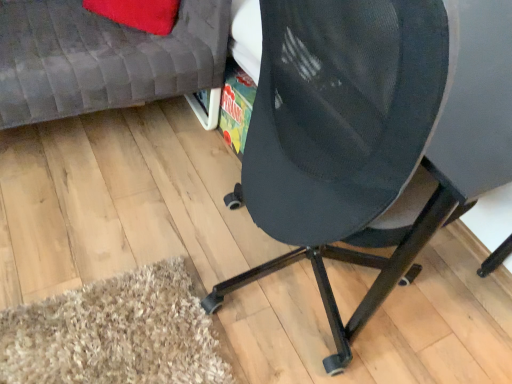
The height and width of the screenshot is (384, 512). Identify the location of matte gray couch at upper left. (102, 59).

What is the approximate width of matte gray couch at upper left?

matte gray couch at upper left is 30.33 inches in width.

What do you see at coordinates (102, 59) in the screenshot? I see `matte gray couch at upper left` at bounding box center [102, 59].

Where is `black mesh chair at center`? Image resolution: width=512 pixels, height=384 pixels. black mesh chair at center is located at coordinates (372, 130).

What is the approximate width of black mesh chair at center?

28.31 inches.

This screenshot has width=512, height=384. Describe the element at coordinates (372, 130) in the screenshot. I see `black mesh chair at center` at that location.

Measure the distance between point (323, 84) and camera.

Point (323, 84) and camera are 28.19 inches apart.

Locate an element on the screen. matte gray couch at upper left is located at coordinates (102, 59).

Does black mesh chair at center appear on the right side of matte gray couch at upper left?

Correct, you'll find black mesh chair at center to the right of matte gray couch at upper left.

From the picture: Is the position of black mesh chair at center less distant than that of matte gray couch at upper left?

Yes, black mesh chair at center is in front of matte gray couch at upper left.

Does point (383, 136) appear closer or farther from the camera than point (35, 20)?

Clearly, point (383, 136) is closer to the camera than point (35, 20).

From the image's perspective, relative to matte gray couch at upper left, is black mesh chair at center above or below?

Based on their image positions, black mesh chair at center is located beneath matte gray couch at upper left.

From a real-world perspective, which object stands above the other?

black mesh chair at center, from a real-world perspective.

Can you confirm if black mesh chair at center is thinner than matte gray couch at upper left?

Yes.

Which of these two, black mesh chair at center or matte gray couch at upper left, stands shorter?

With less height is matte gray couch at upper left.

Considering the sizes of objects black mesh chair at center and matte gray couch at upper left in the image provided, who is smaller, black mesh chair at center or matte gray couch at upper left?

matte gray couch at upper left.

Is black mesh chair at center not inside matte gray couch at upper left?

Yes, black mesh chair at center is outside of matte gray couch at upper left.

Would you say black mesh chair at center is a long distance from matte gray couch at upper left?

They are positioned close to each other.

Is matte gray couch at upper left at the back of black mesh chair at center?

No, black mesh chair at center is not facing away from matte gray couch at upper left.

Based on the photo, can you tell me how much black mesh chair at center and matte gray couch at upper left differ in facing direction?

The facing directions of black mesh chair at center and matte gray couch at upper left are 88.8 degrees apart.

Find the location of a particular element. furniture lying above the black mesh chair at center (from the image's perspective) is located at coordinates (102, 59).

Considering the relative positions of matte gray couch at upper left and black mesh chair at center in the image provided, is matte gray couch at upper left to the right of black mesh chair at center from the viewer's perspective?

No, matte gray couch at upper left is not to the right of black mesh chair at center.

Who is more distant, matte gray couch at upper left or black mesh chair at center?

Positioned behind is matte gray couch at upper left.

Is point (185, 49) positioned behind point (303, 46)?

Yes, it is behind point (303, 46).

From the image's perspective, who appears lower, matte gray couch at upper left or black mesh chair at center?

black mesh chair at center.

From a real-world perspective, is matte gray couch at upper left positioned over black mesh chair at center based on gravity?

Actually, matte gray couch at upper left is physically below black mesh chair at center in the real world.

Looking at this image, is matte gray couch at upper left wider than black mesh chair at center?

Indeed, matte gray couch at upper left has a greater width compared to black mesh chair at center.

Is matte gray couch at upper left taller than black mesh chair at center?

In fact, matte gray couch at upper left may be shorter than black mesh chair at center.

Considering the sizes of objects matte gray couch at upper left and black mesh chair at center in the image provided, who is smaller, matte gray couch at upper left or black mesh chair at center?

With smaller size is matte gray couch at upper left.

Is matte gray couch at upper left positioned beyond the bounds of black mesh chair at center?

matte gray couch at upper left is positioned outside black mesh chair at center.

Is matte gray couch at upper left touching black mesh chair at center?

No, matte gray couch at upper left is not beside black mesh chair at center.

Is matte gray couch at upper left looking in the opposite direction of black mesh chair at center?

No.

In order to click on chair in front of the matte gray couch at upper left in this screenshot , I will do `click(372, 130)`.

Find the location of a particular element. furniture located behind the black mesh chair at center is located at coordinates (102, 59).

Identify the location of chair above the matte gray couch at upper left (from a real-world perspective). (372, 130).